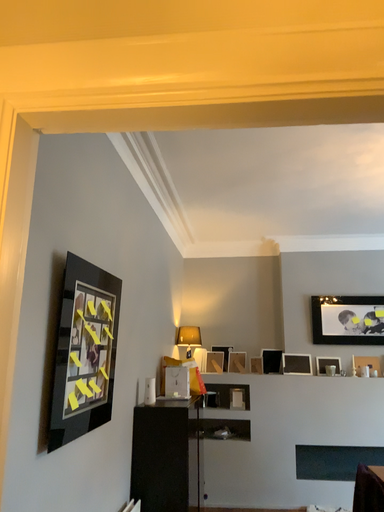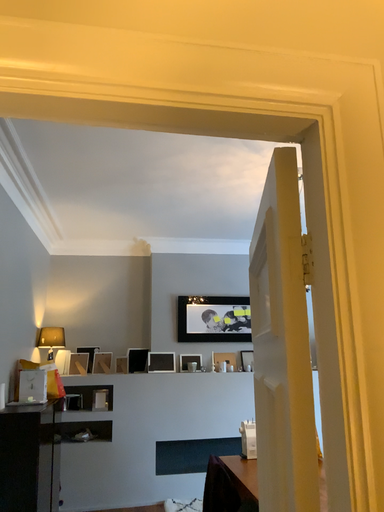
Question: Which way did the camera rotate in the video?

Choices:
 (A) rotated right
 (B) rotated left

Answer: (A)